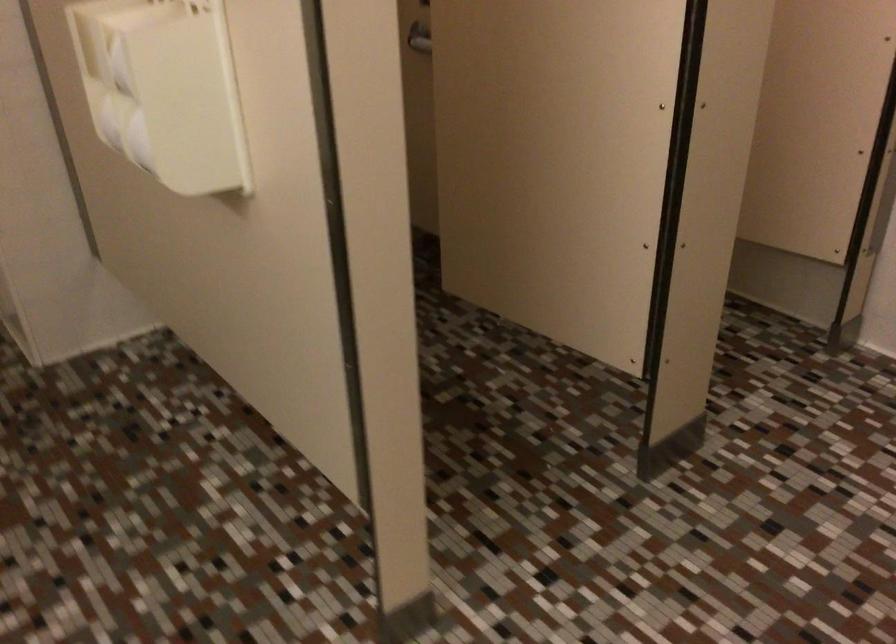
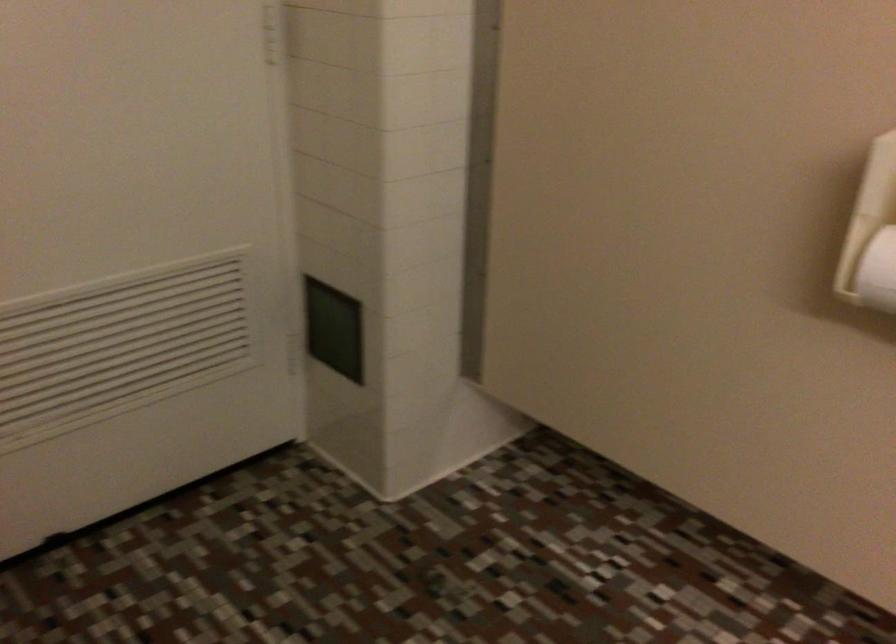
The point at (108, 128) is marked in the first image. Where is the corresponding point in the second image?

(876, 272)